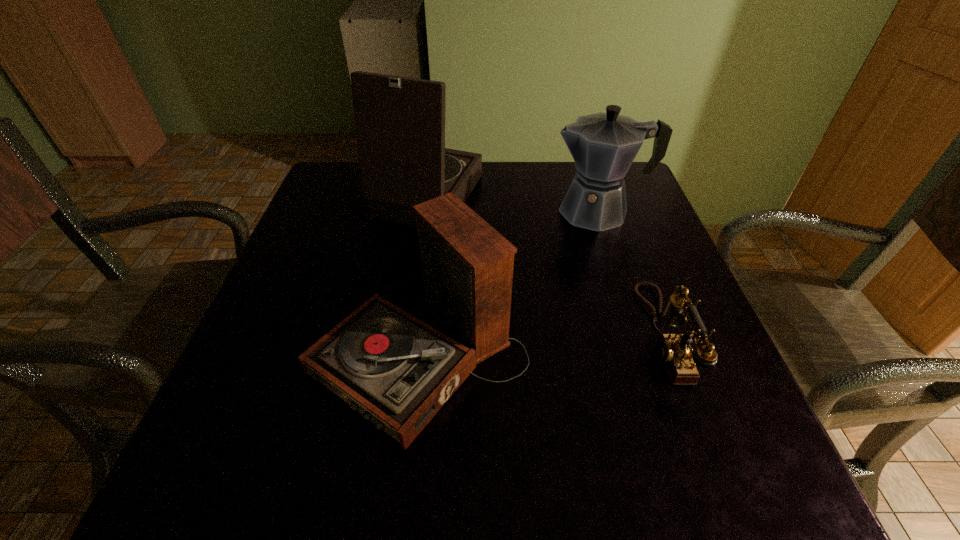
Identify the location of free space between the shorter phonograph record and the shortest object. (540, 346).

Locate an element on the screen. This screenshot has height=540, width=960. free spot between the farther phonograph record and the shortest object is located at coordinates (543, 266).

Where is `free spot between the coffeepot and the shortest object`? free spot between the coffeepot and the shortest object is located at coordinates (630, 273).

Locate an element on the screen. empty location between the coffeepot and the tallest object is located at coordinates (512, 204).

Identify which object is located as the nearest to the telephone. Please provide its 2D coordinates. Your answer should be formatted as a tuple, i.e. [(x, y)], where the tuple contains the x and y coordinates of a point satisfying the conditions above.

[(603, 145)]

This screenshot has height=540, width=960. What are the coordinates of `the closest object to the farther phonograph record` in the screenshot? It's located at (397, 371).